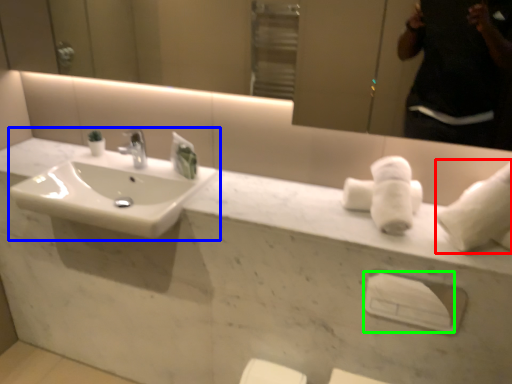
Question: Which is farther away from bath towel (highlighted by a red box)? sink (highlighted by a blue box) or towel bar (highlighted by a green box)?

Choices:
 (A) sink
 (B) towel bar

Answer: (A)